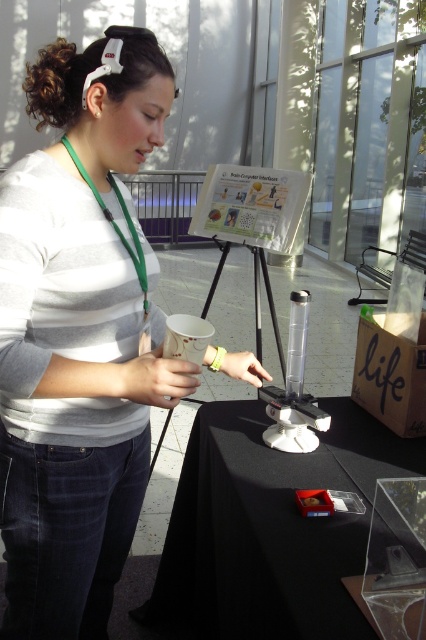
Looking at this image, is black matte table at center closer to the viewer compared to clear plastic tube at center?

Yes, black matte table at center is closer to the viewer.

Who is positioned more to the left, black matte table at center or clear plastic tube at center?

black matte table at center is more to the left.

Is point (213, 435) closer to viewer compared to point (293, 353)?

No, it is not.

This screenshot has height=640, width=426. I want to click on black matte table at center, so click(x=271, y=525).

Is white matte shirt at upper left taller than clear plastic tube at center?

Yes.

This screenshot has height=640, width=426. Describe the element at coordinates (80, 333) in the screenshot. I see `white matte shirt at upper left` at that location.

Who is more forward, (123, 154) or (298, 292)?

Point (123, 154) is in front.

At what (x,y) coordinates should I click in order to perform the action: click on white matte shirt at upper left. Please return your answer as a coordinate pair (x, y). The width and height of the screenshot is (426, 640). Looking at the image, I should click on (80, 333).

Consider the image. Is white matte shirt at upper left positioned before black matte table at center?

No.

Who is lower down, white matte shirt at upper left or black matte table at center?

Positioned lower is black matte table at center.

Does point (54, 500) lie behind point (305, 477)?

No, (54, 500) is closer to viewer.

Image resolution: width=426 pixels, height=640 pixels. Identify the location of white matte shirt at upper left. [80, 333].